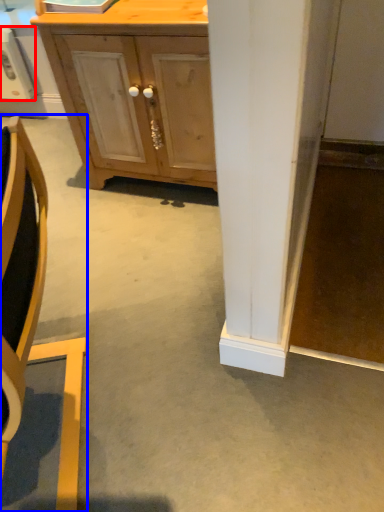
Question: Which point is closer to the camera, appliance (highlighted by a red box) or chair (highlighted by a blue box)?

Choices:
 (A) appliance
 (B) chair

Answer: (B)